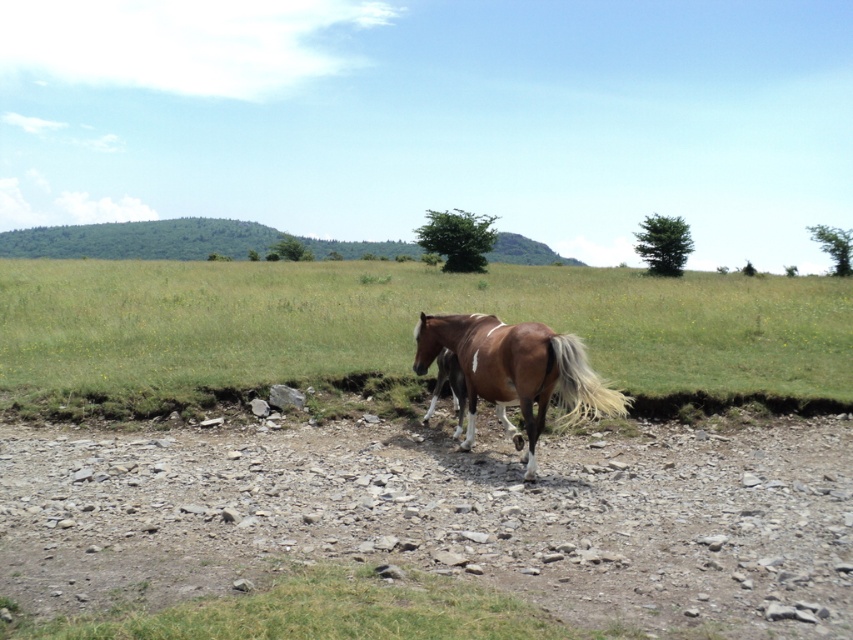
Question: Observing the image, what is the correct spatial positioning of brown grass at center in reference to brown glossy horse at center?

Choices:
 (A) above
 (B) below

Answer: (A)

Question: Can you confirm if brown gravel dirt track at center is positioned above brown grass at center?

Choices:
 (A) no
 (B) yes

Answer: (A)

Question: Which point is closer to the camera taking this photo?

Choices:
 (A) (387, 372)
 (B) (744, 541)
 (C) (427, 328)

Answer: (B)

Question: Which point is farther from the camera taking this photo?

Choices:
 (A) (595, 330)
 (B) (456, 321)
 (C) (41, 449)

Answer: (A)

Question: Does brown gravel dirt track at center have a greater width compared to brown grass at center?

Choices:
 (A) no
 (B) yes

Answer: (A)

Question: Which object is farther from the camera taking this photo?

Choices:
 (A) brown grass at center
 (B) brown gravel dirt track at center

Answer: (A)